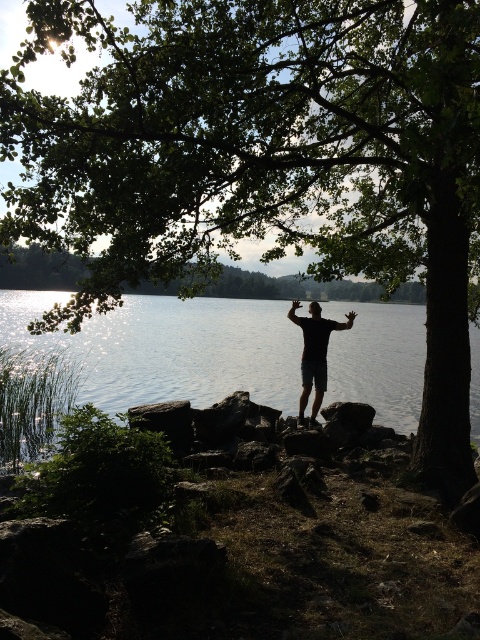
Question: Which object is farther from the camera taking this photo?

Choices:
 (A) black matte arm at upper center
 (B) black matte arm at center

Answer: (A)

Question: Does clear water at center lie behind black matte arm at center?

Choices:
 (A) yes
 (B) no

Answer: (A)

Question: Does clear water at center have a greater width compared to black matte shorts at center?

Choices:
 (A) yes
 (B) no

Answer: (A)

Question: Among these points, which one is nearest to the camera?

Choices:
 (A) (336, 385)
 (B) (314, 339)
 (C) (298, 323)
 (D) (343, 323)

Answer: (B)

Question: Where is clear water at center located in relation to black matte arm at center in the image?

Choices:
 (A) right
 (B) left

Answer: (B)

Question: Among these points, which one is farthest from the camera?

Choices:
 (A) (386, 358)
 (B) (321, 380)

Answer: (A)